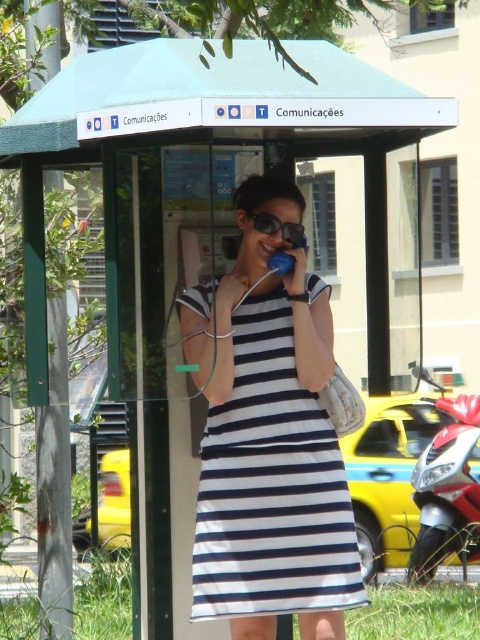
The woman in the navy blue striped dress at center is holding a blue telephone receiver and a light shoulder bag. If the telephone booth is 17.11 feet away from her, can she reach it without moving her feet?

The navy blue striped dress at center is 17.11 feet away from the telephone booth. Since the average human arm span is about 5 feet, she cannot reach the telephone booth without moving her feet.

You are taking a photo of the telephone booth and the woman. You want to focus on the point at point (252, 99) and point (302, 240). Which point should you focus on first to ensure both points are in focus?

Point (252, 99) is closer to the camera than point (302, 240), so you should focus on point (252, 99) first to ensure both points are in focus.

What are the coordinates of the navy blue striped dress at center?

The navy blue striped dress at center is located at coordinates point (271, 484).